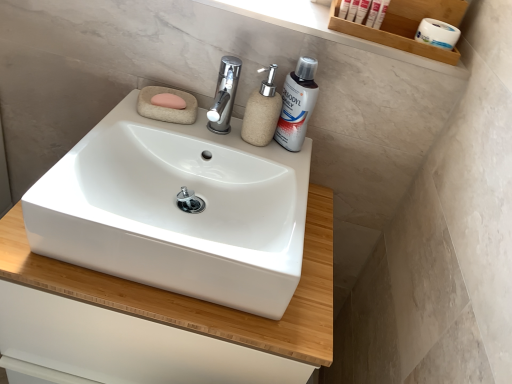
Identify the location of vacant space that is to the left of white plastic tube at upper right. (290, 11).